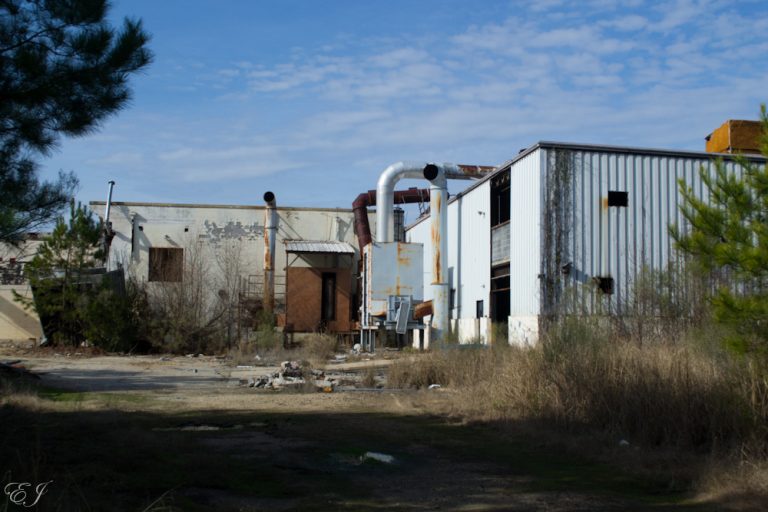
The width and height of the screenshot is (768, 512). I want to click on chimney, so click(733, 143), click(101, 189).